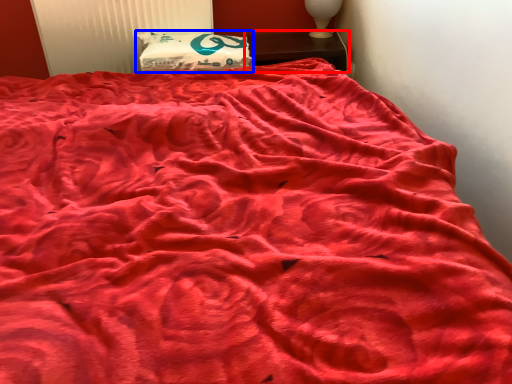
Question: Which object appears farthest to the camera in this image, furniture (highlighted by a red box) or pillow (highlighted by a blue box)?

Choices:
 (A) furniture
 (B) pillow

Answer: (A)